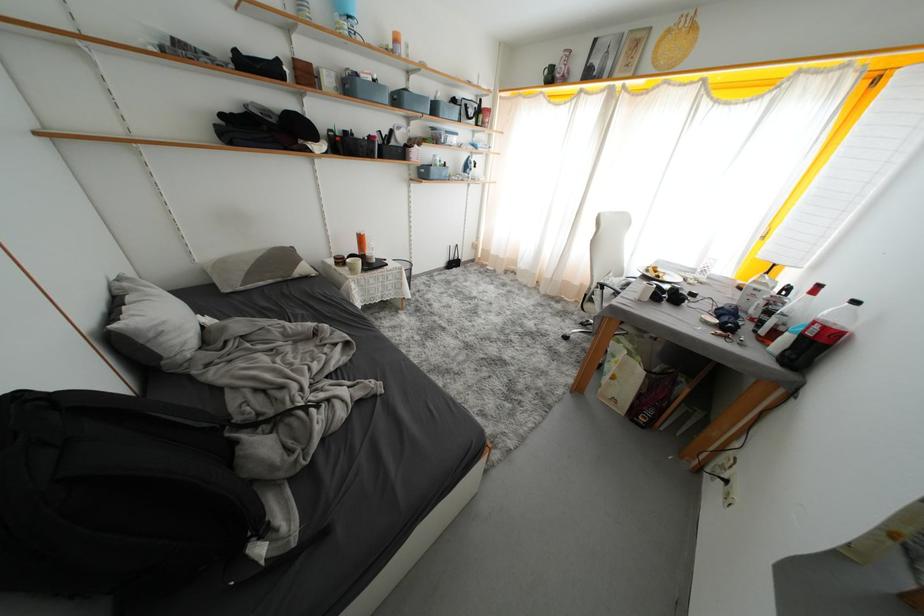
Locate an element on the screen. The width and height of the screenshot is (924, 616). black backpack handle is located at coordinates (137, 406).